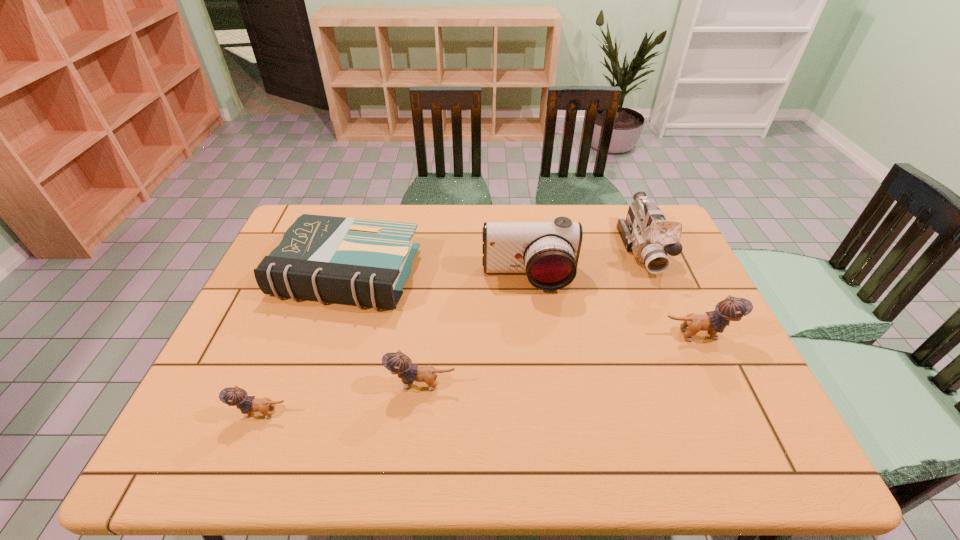
If equal spacing is the goal by inserting an additional kitten among them, please point out a vacant space for this new kitten. Please provide its 2D coordinates. Your answer should be formatted as a tuple, i.e. [(x, y)], where the tuple contains the x and y coordinates of a point satisfying the conditions above.

[(566, 359)]